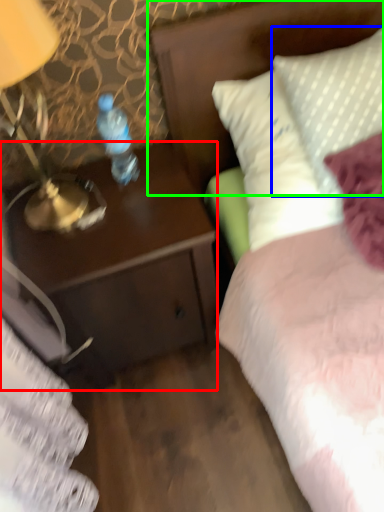
Question: Which object is positioned closest to desk (highlighted by a red box)? Select from pillow (highlighted by a blue box) and headboard (highlighted by a green box).

Choices:
 (A) pillow
 (B) headboard

Answer: (B)